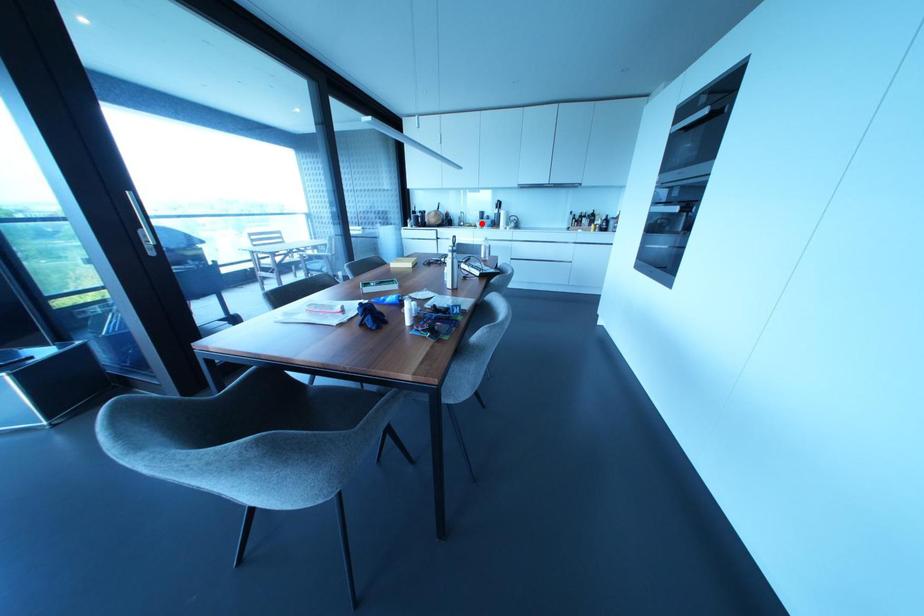
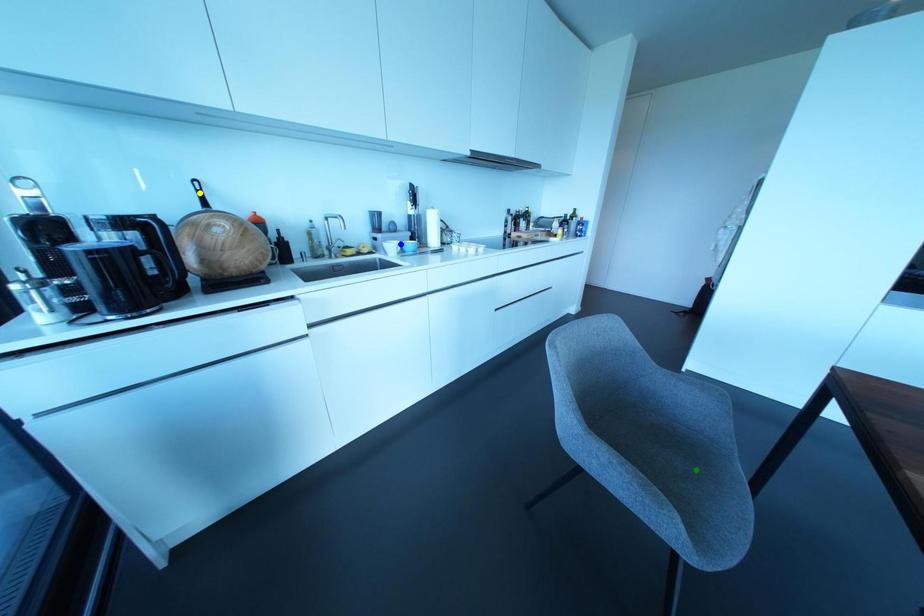
Question: I am providing you with two images of the same scene from different viewpoints. A red point is marked on the first image. You are given multiple points on the second image. Can you choose the point in image 2 that corresponds to the point in image 1?

Choices:
 (A) green point
 (B) blue point
 (C) yellow point

Answer: (B)